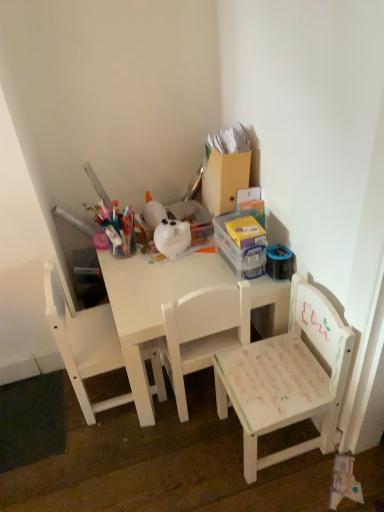
At what (x,y) coordinates should I click in order to perform the action: click on vacant space that is to the left of white matte chair at center, which ranks as the third chair in right-to-left order. Please return your answer as a coordinate pair (x, y). Looking at the image, I should click on (39, 404).